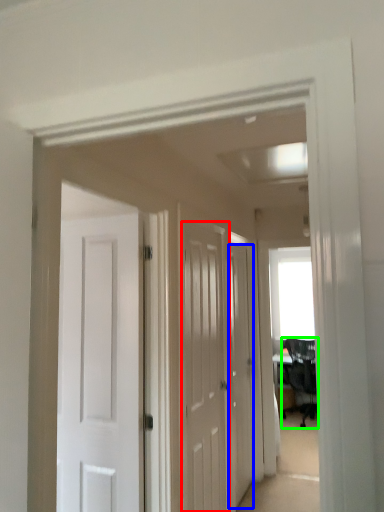
Question: Which object is the farthest from door (highlighted by a red box)? Choose among these: door (highlighted by a blue box) or chair (highlighted by a green box).

Choices:
 (A) door
 (B) chair

Answer: (B)